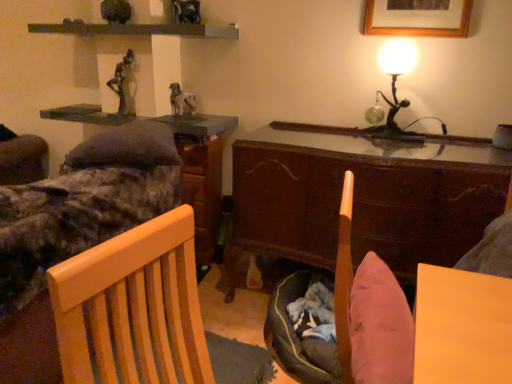
The image size is (512, 384). Describe the element at coordinates (202, 189) in the screenshot. I see `wooden file cabinet at center` at that location.

This screenshot has width=512, height=384. What do you see at coordinates (417, 20) in the screenshot? I see `wooden picture frame at upper right` at bounding box center [417, 20].

Identify the location of metallic gold table lamp at upper right. pyautogui.click(x=395, y=93).

Describe the element at coordinates (133, 307) in the screenshot. I see `light wood chair at left` at that location.

Describe the element at coordinates (362, 198) in the screenshot. I see `wooden cabinet at center` at that location.

The height and width of the screenshot is (384, 512). Find the location of `wooden cabinet at center`. wooden cabinet at center is located at coordinates (362, 198).

I want to click on wooden file cabinet at center, so point(202,189).

Locate an element on the screen. This screenshot has height=384, width=512. table located behind the wooden bed frame at left is located at coordinates (182, 160).

How many degrees apart are the facing directions of matte gray table at upper left and wooden bed frame at left?

The angular difference between matte gray table at upper left and wooden bed frame at left is 20.4 degrees.

Is matte gray table at upper left wider or thinner than wooden bed frame at left?

Considering their sizes, matte gray table at upper left looks slimmer than wooden bed frame at left.

Based on the photo, from a real-world perspective, is matte gray table at upper left beneath wooden bed frame at left?

Actually, matte gray table at upper left is physically above wooden bed frame at left in the real world.

Considering the sizes of wooden cabinet at center and wooden file cabinet at center in the image, is wooden cabinet at center wider or thinner than wooden file cabinet at center?

wooden cabinet at center is wider than wooden file cabinet at center.

Is wooden cabinet at center taller or shorter than wooden file cabinet at center?

wooden cabinet at center is taller than wooden file cabinet at center.

Which object is positioned more to the right, wooden cabinet at center or wooden file cabinet at center?

wooden cabinet at center.

From the image's perspective, is furry white dog at center above or below wooden cabinet at center?

Based on their image positions, furry white dog at center is located above wooden cabinet at center.

Based on the photo, is furry white dog at center outside of wooden cabinet at center?

Yes, furry white dog at center is outside of wooden cabinet at center.

Which point is more distant from viewer, (173,113) or (475,170)?

The point (173,113) is farther.

Between furry white dog at center and wooden cabinet at center, which one appears on the right side from the viewer's perspective?

Positioned to the right is wooden cabinet at center.

Is wooden cabinet at center aimed at wooden shelf at upper center?

No, wooden cabinet at center does not turn towards wooden shelf at upper center.

What's the angular difference between wooden cabinet at center and wooden shelf at upper center's facing directions?

1.64 degrees.

This screenshot has width=512, height=384. I want to click on cabinetry below the wooden shelf at upper center (from the image's perspective), so click(x=362, y=198).

Based on the photo, visually, is wooden cabinet at center positioned to the left or to the right of wooden shelf at upper center?

In the image, wooden cabinet at center appears on the right side of wooden shelf at upper center.

Are wooden cabinet at center and metallic gold table lamp at upper right located far from each other?

No, wooden cabinet at center is not far away from metallic gold table lamp at upper right.

From a real-world perspective, is wooden cabinet at center above or below metallic gold table lamp at upper right?

wooden cabinet at center is below metallic gold table lamp at upper right.

Looking at this image, considering the relative sizes of wooden cabinet at center and metallic gold table lamp at upper right in the image provided, is wooden cabinet at center thinner than metallic gold table lamp at upper right?

In fact, wooden cabinet at center might be wider than metallic gold table lamp at upper right.

Choose the correct answer: Is wooden bed frame at left inside bronze statue at upper center or outside it?

wooden bed frame at left exists outside the volume of bronze statue at upper center.

Who is bigger, wooden bed frame at left or bronze statue at upper center?

wooden bed frame at left is bigger.

Based on the photo, is wooden bed frame at left oriented towards bronze statue at upper center?

No.

Locate an element on the screen. The image size is (512, 384). bed frame in front of the bronze statue at upper center is located at coordinates (73, 220).

In order to click on animal below the wooden picture frame at upper right (from the image's perspective) in this screenshot , I will do `click(182, 100)`.

How many degrees apart are the facing directions of furry white dog at center and wooden picture frame at upper right?

The angle between the facing direction of furry white dog at center and the facing direction of wooden picture frame at upper right is 2.44 degrees.

Considering the positions of objects furry white dog at center and wooden picture frame at upper right in the image provided, who is behind, furry white dog at center or wooden picture frame at upper right?

furry white dog at center is further away from the camera.

Could you tell me if furry white dog at center is facing wooden picture frame at upper right?

No.

This screenshot has width=512, height=384. I want to click on bed frame below the matte gray table at upper left (from the image's perspective), so click(73, 220).

Image resolution: width=512 pixels, height=384 pixels. I want to click on cabinetry on the right side of wooden file cabinet at center, so click(362, 198).

Which object lies nearer to the anchor point furry white dog at center, matte gray table at upper left or wooden bed frame at left?

matte gray table at upper left is positioned closer to the anchor furry white dog at center.

Looking at the image, which one is located closer to wooden file cabinet at center, light wood chair at left or wooden picture frame at upper right?

The object closer to wooden file cabinet at center is wooden picture frame at upper right.

In the scene shown: When comparing their distances from wooden file cabinet at center, does bronze statue at upper center or light wood chair at left seem further?

light wood chair at left is further to wooden file cabinet at center.

Estimate the real-world distances between objects in this image. Which object is further from matte gray table at upper left, furry white dog at center or wooden picture frame at upper right?

wooden picture frame at upper right lies further to matte gray table at upper left than the other object.

When comparing their distances from bronze statue at upper center, does wooden picture frame at upper right or light wood chair at left seem closer?

The object closer to bronze statue at upper center is wooden picture frame at upper right.

When comparing their distances from wooden file cabinet at center, does wooden bed frame at left or bronze statue at upper center seem further?

wooden bed frame at left is further to wooden file cabinet at center.

Which object lies nearer to the anchor point furry white dog at center, wooden cabinet at center or wooden picture frame at upper right?

wooden cabinet at center is closer to furry white dog at center.

Which object lies nearer to the anchor point light wood chair at left, wooden shelf at upper center or wooden file cabinet at center?

wooden file cabinet at center is positioned closer to the anchor light wood chair at left.

Where is `cabinetry located between wooden shelf at upper center and wooden picture frame at upper right in the left-right direction`? This screenshot has height=384, width=512. cabinetry located between wooden shelf at upper center and wooden picture frame at upper right in the left-right direction is located at coordinates (362, 198).

Locate an element on the screen. The height and width of the screenshot is (384, 512). table between wooden shelf at upper center and light wood chair at left in the up-down direction is located at coordinates (182, 160).

This screenshot has width=512, height=384. What are the coordinates of `table lamp between bronze statue at upper center and wooden picture frame at upper right` in the screenshot? It's located at (395, 93).

I want to click on bed frame positioned between light wood chair at left and wooden file cabinet at center from near to far, so click(73, 220).